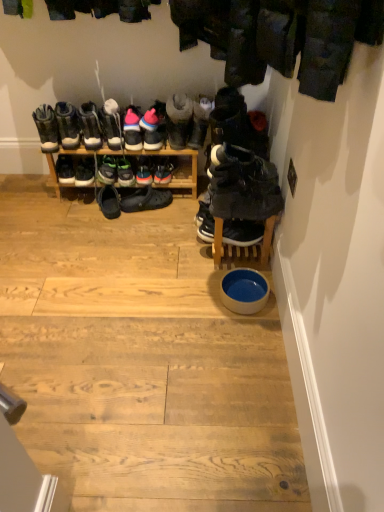
Find the location of a particular element. free space in front of wooden shoe rack at center is located at coordinates (111, 245).